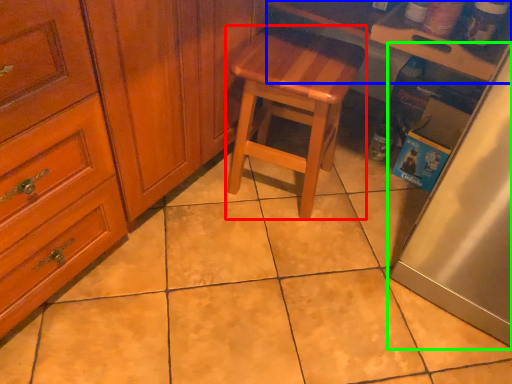
Question: Estimate the real-world distances between objects in this image. Which object is closer to stool (highlighted by a red box), counter top (highlighted by a blue box) or fridge (highlighted by a green box)?

Choices:
 (A) counter top
 (B) fridge

Answer: (A)